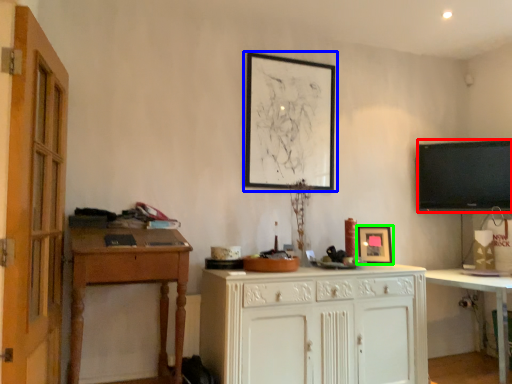
Question: Which is farther away from television (highlighted by a red box)? picture frame (highlighted by a blue box) or picture frame (highlighted by a green box)?

Choices:
 (A) picture frame
 (B) picture frame

Answer: (A)